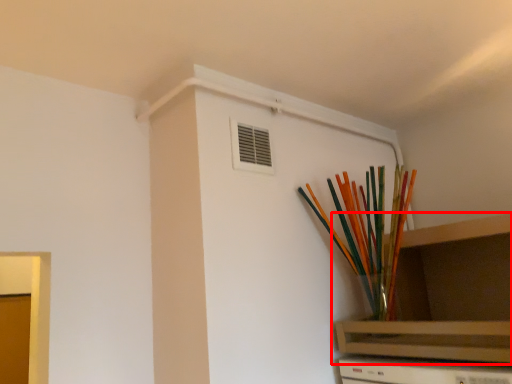
Question: Considering the relative positions of shelf (annotated by the red box) and paint brush in the image provided, where is shelf (annotated by the red box) located with respect to the staircase?

Choices:
 (A) left
 (B) right

Answer: (B)